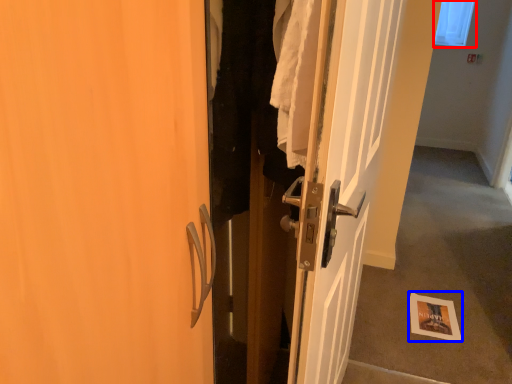
Question: Which object appears closest to the camera in this image, window screen (highlighted by a red box) or postcard (highlighted by a blue box)?

Choices:
 (A) window screen
 (B) postcard

Answer: (B)